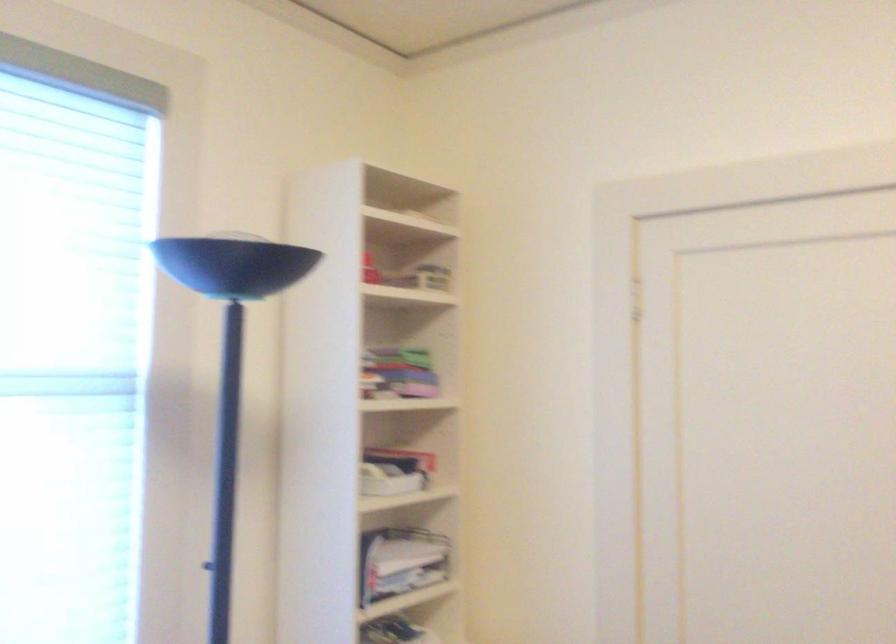
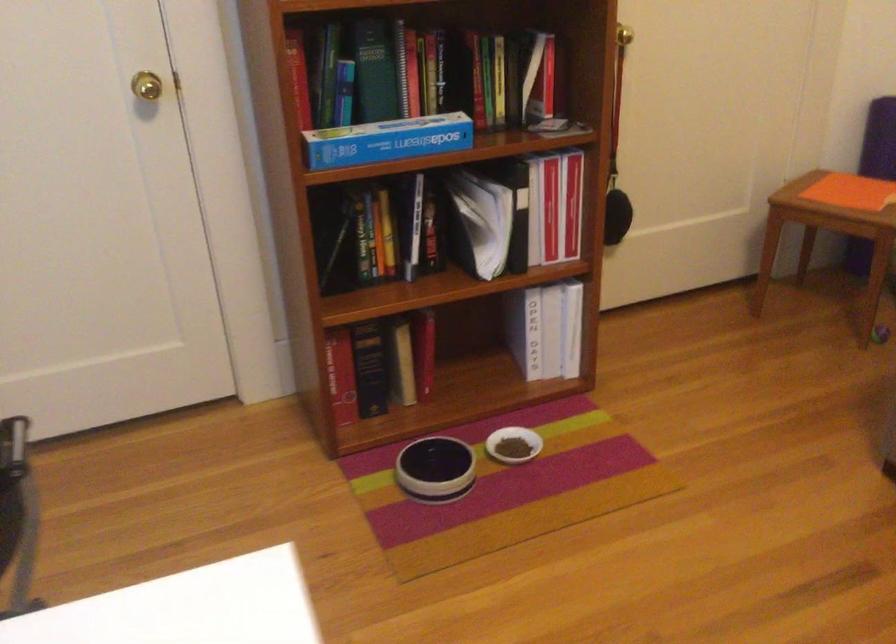
First-person continuous shooting, in which direction is the camera rotating?

The camera rotated toward right-down.